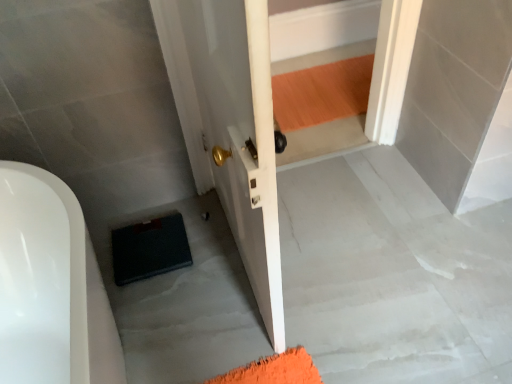
This screenshot has height=384, width=512. Identify the location of free location to the right of dark blue rubber mat at lower left. (212, 249).